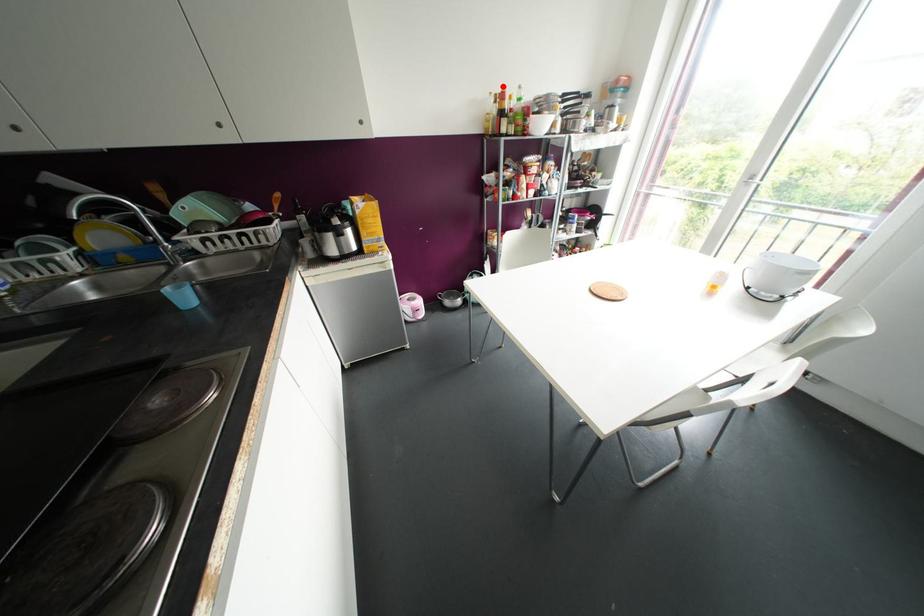
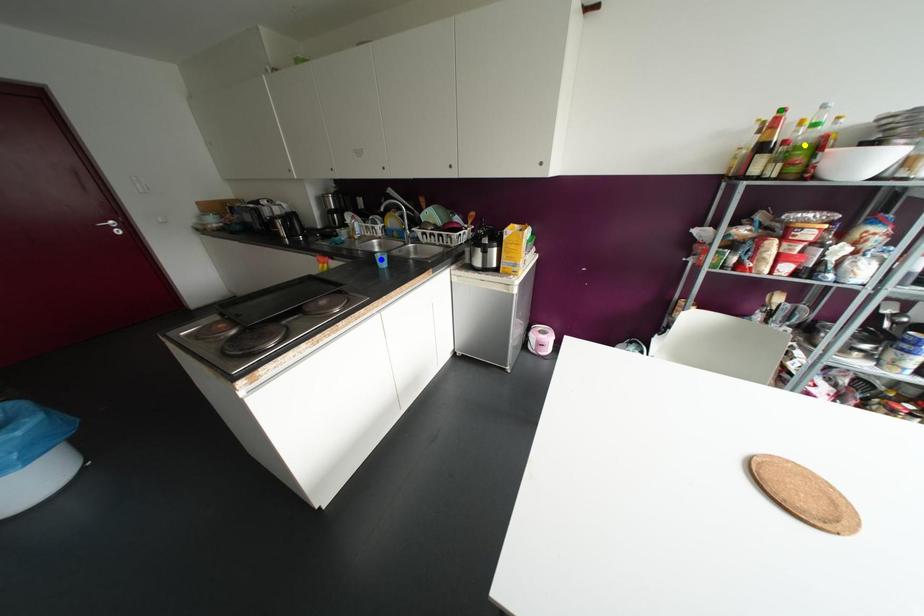
Question: I am providing you with two images of the same scene from different viewpoints. A red point is marked on the first image. You are given multiple points on the second image. Which mark in image 2 goes with the point in image 1?

Choices:
 (A) green point
 (B) blue point
 (C) yellow point

Answer: (A)